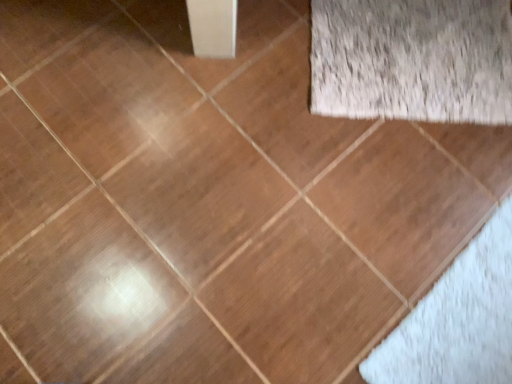
Measure the distance between white fluffy rug at upper right and camera.

white fluffy rug at upper right is 1.07 meters away from camera.

This screenshot has width=512, height=384. Describe the element at coordinates (412, 60) in the screenshot. I see `white fluffy rug at upper right` at that location.

I want to click on white fluffy rug at upper right, so click(x=412, y=60).

Where is `white fluffy rug at upper right`? white fluffy rug at upper right is located at coordinates (412, 60).